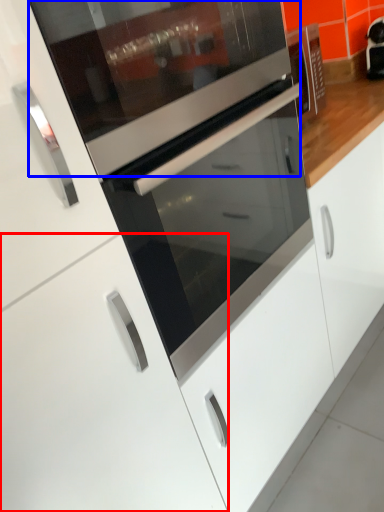
Question: Which point is further to the camera, cabinetry (highlighted by a red box) or appliance (highlighted by a blue box)?

Choices:
 (A) cabinetry
 (B) appliance

Answer: (A)